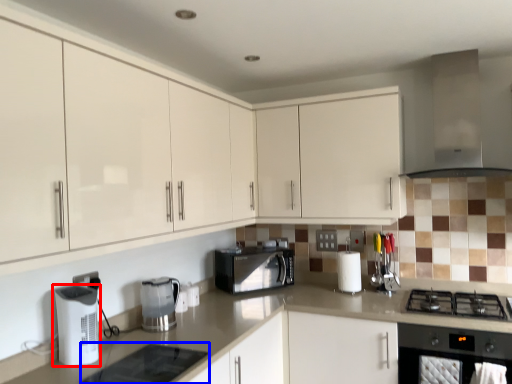
Question: Which object appears farthest to the camera in this image, kitchen appliance (highlighted by a red box) or appliance (highlighted by a blue box)?

Choices:
 (A) kitchen appliance
 (B) appliance

Answer: (A)